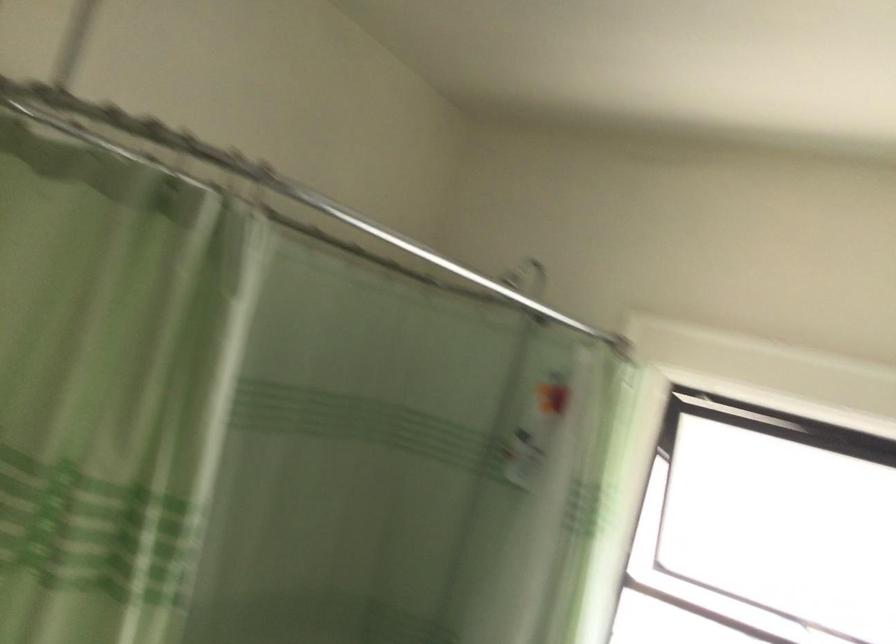
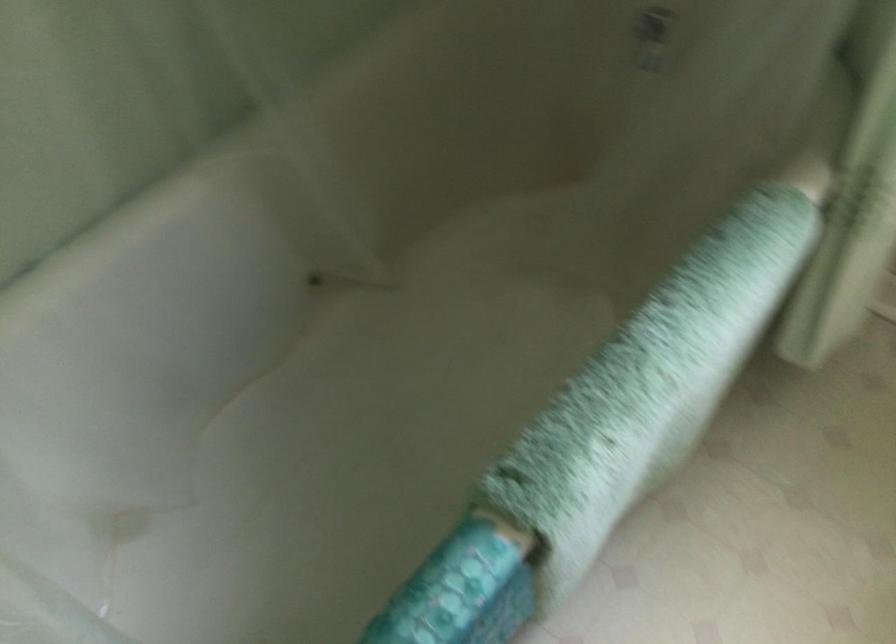
The first image is from the beginning of the video and the second image is from the end. How did the camera likely rotate when shooting the video?

The camera rotated toward left-down.